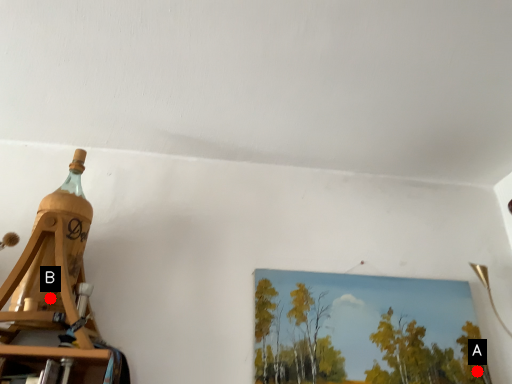
Question: Two points are circled on the image, labeled by A and B beside each circle. Which point appears farthest from the camera in this image?

Choices:
 (A) A is further
 (B) B is further

Answer: (A)